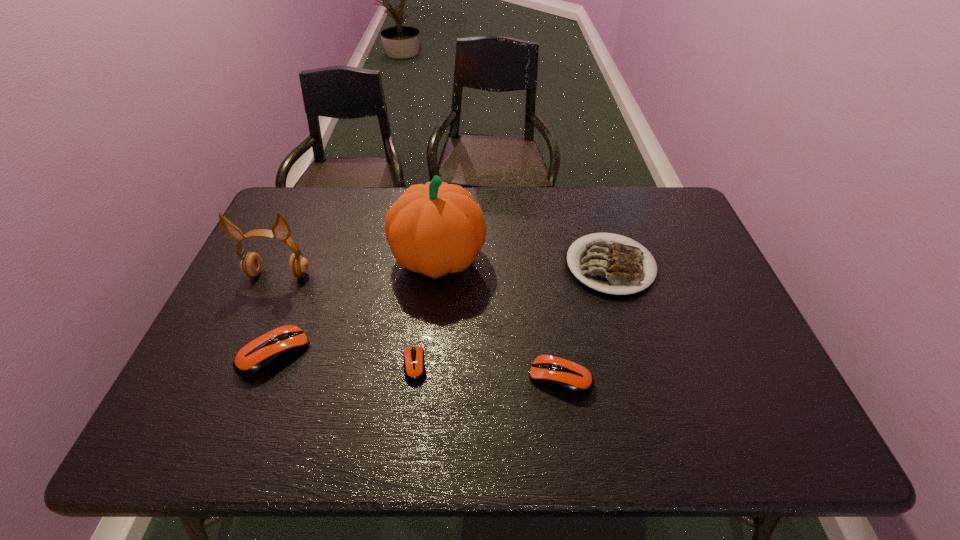
The image size is (960, 540). In order to click on free space located 0.370m on the left of the plate in this screenshot , I will do `click(435, 266)`.

This screenshot has height=540, width=960. Identify the location of vacant space positioned 0.060m on the left of the tallest object. (371, 259).

The height and width of the screenshot is (540, 960). In order to click on free space located on the front-facing side of the earphone in this screenshot , I will do `click(252, 335)`.

Where is `object present at the far edge`? object present at the far edge is located at coordinates (438, 228).

Find the location of `computer mouse that is at the left edge`. computer mouse that is at the left edge is located at coordinates (260, 356).

Where is `earphone present at the left edge`? earphone present at the left edge is located at coordinates click(251, 264).

This screenshot has height=540, width=960. Identify the location of object at the right edge. (607, 266).

Identify the location of object at the near left corner. Image resolution: width=960 pixels, height=540 pixels. (260, 356).

Find the location of a particular element. free space at the far edge of the desktop is located at coordinates (330, 212).

Where is `vacant space at the near edge`? vacant space at the near edge is located at coordinates (610, 382).